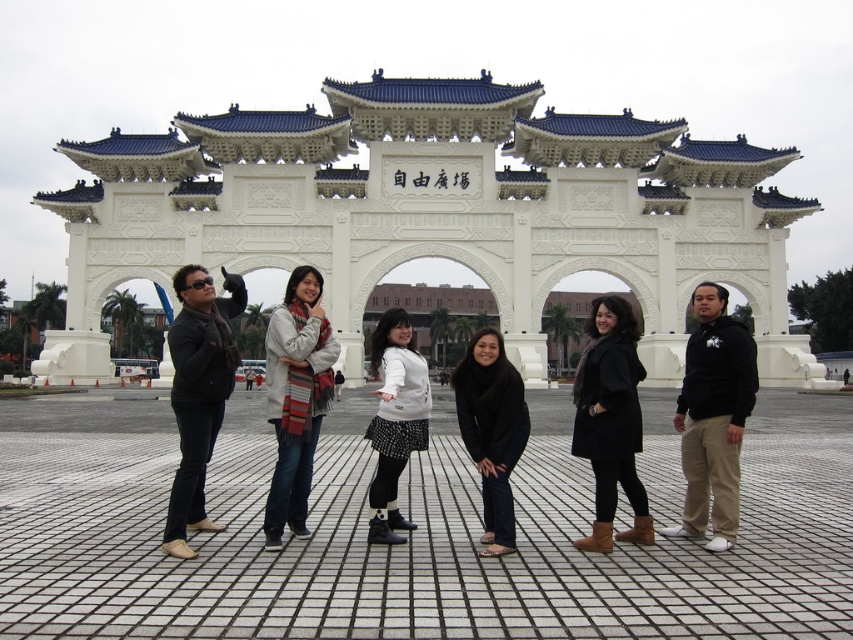
Does black matte coat at center have a greater height compared to white matte sweater at center?

Yes, black matte coat at center is taller than white matte sweater at center.

What do you see at coordinates (610, 420) in the screenshot?
I see `black matte coat at center` at bounding box center [610, 420].

Between point (628, 529) and point (372, 336), which one is positioned behind?

Point (372, 336)

Identify the location of black matte coat at center. The image size is (853, 640). (610, 420).

From the picture: Who is positioned more to the left, striped scarf at center or white matte sweater at center?

striped scarf at center is more to the left.

Does striped scarf at center appear under white matte sweater at center?

No, striped scarf at center is not below white matte sweater at center.

Between point (294, 385) and point (378, 332), which one is positioned behind?

The point (378, 332) is more distant.

Where is `striped scarf at center`? The image size is (853, 640). striped scarf at center is located at coordinates (296, 397).

Does white stone gate at center appear under black matte pants at center?

No.

Is white stone gate at center taller than black matte pants at center?

Correct, white stone gate at center is much taller as black matte pants at center.

Where is `white stone gate at center`? white stone gate at center is located at coordinates (433, 211).

This screenshot has height=640, width=853. I want to click on white stone gate at center, so click(433, 211).